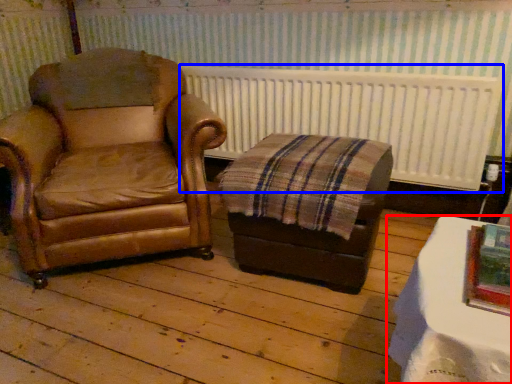
Question: Which object is further to the camera taking this photo, table (highlighted by a red box) or radiator (highlighted by a blue box)?

Choices:
 (A) table
 (B) radiator

Answer: (B)